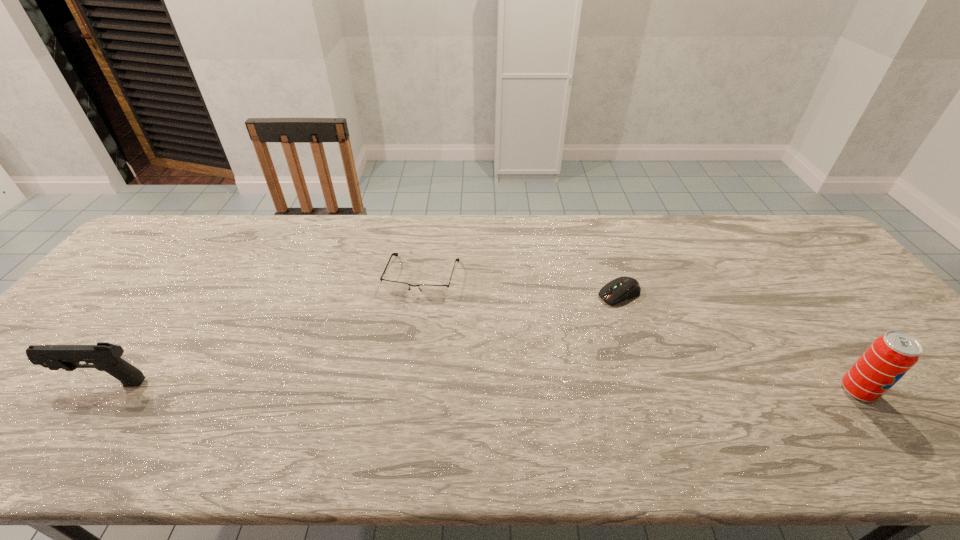
This screenshot has width=960, height=540. In order to click on vacant point located between the rightmost object and the second object from right to left in this screenshot , I will do `click(738, 342)`.

Where is `the third closest object relative to the spectacles`? This screenshot has height=540, width=960. the third closest object relative to the spectacles is located at coordinates (890, 356).

Find the location of a particular element. The image size is (960, 540). object that stands as the third closest to the third object from right to left is located at coordinates (890, 356).

Find the location of a particular element. free space that satisfies the following two spatial constraints: 1. on the front side of the computer equipment; 2. on the left side of the second object from left to right is located at coordinates (420, 293).

Where is `free space that satisfies the following two spatial constraints: 1. on the front side of the computer equipment; 2. on the right side of the spectacles`? free space that satisfies the following two spatial constraints: 1. on the front side of the computer equipment; 2. on the right side of the spectacles is located at coordinates (420, 293).